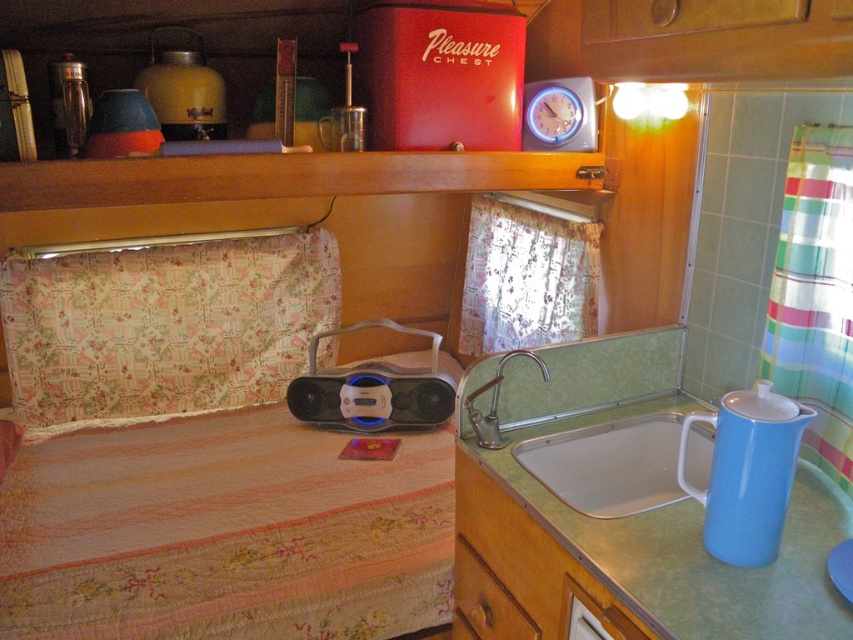
Who is lower down, floral fabric pillow at left or brushed metal faucet at sink center?

brushed metal faucet at sink center is below.

In the scene shown: How much distance is there between floral fabric pillow at left and brushed metal faucet at sink center?

floral fabric pillow at left and brushed metal faucet at sink center are 1.12 meters apart from each other.

Between point (146, 326) and point (479, 428), which one is positioned behind?

Positioned behind is point (146, 326).

At what (x,y) coordinates should I click in order to perform the action: click on floral fabric pillow at left. Please return your answer as a coordinate pair (x, y). The width and height of the screenshot is (853, 640). Looking at the image, I should click on (163, 328).

Who is shorter, white glossy sink at lower center or brushed metal faucet at sink center?

Standing shorter between the two is brushed metal faucet at sink center.

Which is above, white glossy sink at lower center or brushed metal faucet at sink center?

brushed metal faucet at sink center is higher up.

What are the coordinates of `white glossy sink at lower center` in the screenshot? It's located at (619, 464).

The image size is (853, 640). What are the coordinates of `white glossy sink at lower center` in the screenshot? It's located at (619, 464).

In the scene shown: Does floral fabric pillow at left have a smaller size compared to wooden drawer at lower center?

No, floral fabric pillow at left is not smaller than wooden drawer at lower center.

This screenshot has width=853, height=640. What do you see at coordinates (163, 328) in the screenshot?
I see `floral fabric pillow at left` at bounding box center [163, 328].

Find the location of a particular element. This screenshot has height=640, width=853. floral fabric pillow at left is located at coordinates (163, 328).